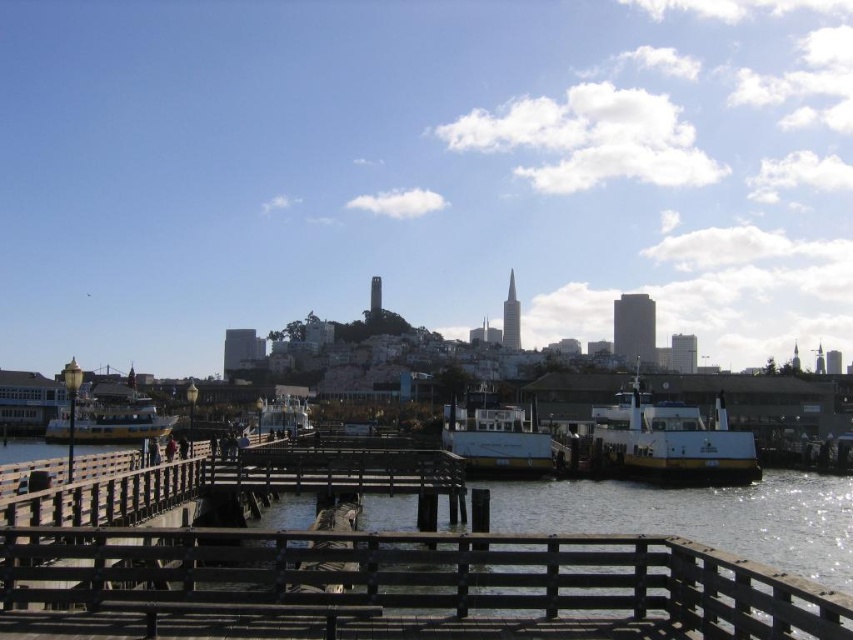
Question: Which point is closer to the camera taking this photo?

Choices:
 (A) (77, 440)
 (B) (637, 456)
 (C) (517, 458)
 (D) (280, 410)

Answer: (C)

Question: Which is nearer to the yellow matte boat at right?

Choices:
 (A) white matte boat at center
 (B) yellow polished wood ferry at left
 (C) white glossy boat at center

Answer: (A)

Question: Does yellow polished wood ferry at left appear under white glossy boat at center?

Choices:
 (A) yes
 (B) no

Answer: (A)

Question: Which of these objects is positioned closest to the white matte boat at center?

Choices:
 (A) yellow polished wood ferry at left
 (B) white glossy boat at center

Answer: (B)

Question: Considering the relative positions of yellow polished wood ferry at left and white glossy boat at center in the image provided, where is yellow polished wood ferry at left located with respect to white glossy boat at center?

Choices:
 (A) right
 (B) left

Answer: (B)

Question: Can you confirm if yellow matte boat at right is bigger than white glossy boat at center?

Choices:
 (A) yes
 (B) no

Answer: (B)